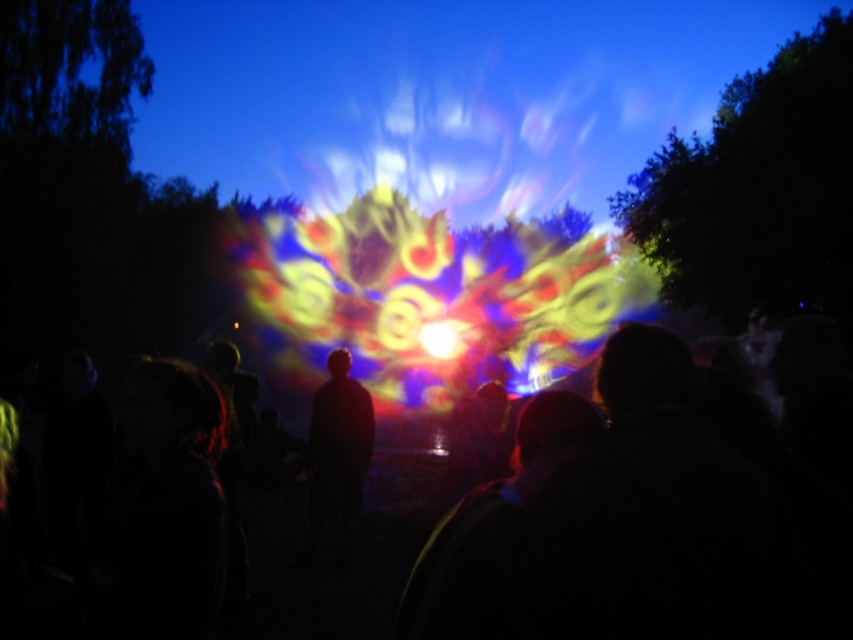
You are standing at the edge of the scene and want to take a photo of the silhouette figure at center and the bright yellow light at center. Which object will appear smaller in your photo?

The silhouette figure at center will appear smaller in the photo because its width is less than the bright yellow light at center.

You are standing at the edge of the scene and want to take a photo of the bright yellow light at center without the black matte crowd at center blocking the view. Is it possible?

The black matte crowd at center is located below the bright yellow light at center, so you can take a photo of the bright yellow light at center without the crowd blocking the view by positioning yourself above or to the side of the crowd.